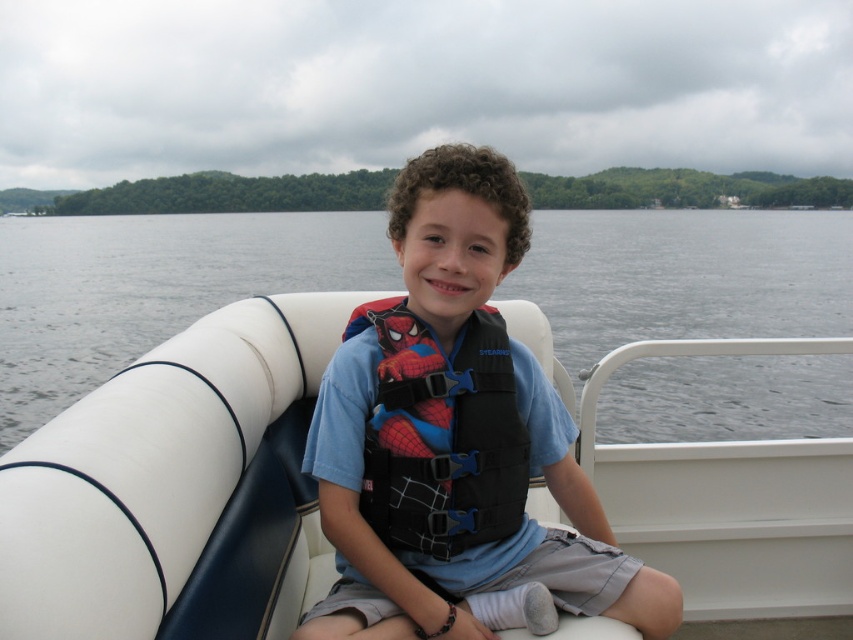
You are a photographer trying to capture the clear water at center in the image. The camera is positioned at point [151,289]. Can you confirm if the clear water at center is directly in front of you?

The clear water at center is located at point [151,289], which is where the camera is positioned. Therefore, the clear water at center is directly in front of you.

You are a lifeguard on duty and notice the white vinyl boat at center and the clear water at center. Based on their heights, which one is shorter?

The white vinyl boat at center is shorter than the clear water at center.